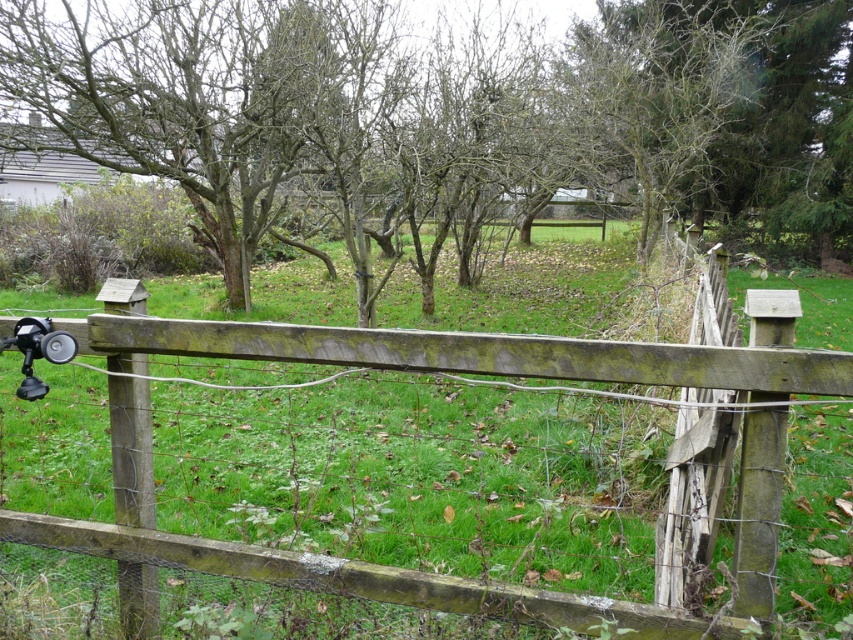
You are standing in a rural area and see the weathered wood fence at center and the brown wood tree at center. Which object is closer to you?

The weathered wood fence at center is closer to you because it is positioned under the brown wood tree at center, meaning the fence is in front of the tree.

You are a photographer setting up equipment in a rural area. You have a matte black camera at lower left and a weathered wood fence at center. Which object is taller?

The weathered wood fence at center is taller than the matte black camera at lower left according to the description.

You are standing at the origin point of the image. You want to walk to the weathered wood fence at center. In which direction should you move?

The weathered wood fence at center is located at point (407, 476), so you should move towards the right and forward to reach it.